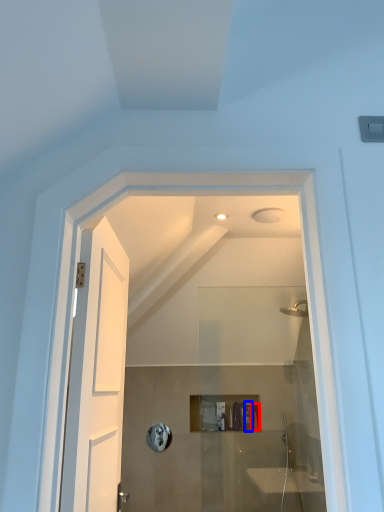
Question: Which object is closer to the camera taking this photo, toiletry (highlighted by a red box) or toiletry (highlighted by a blue box)?

Choices:
 (A) toiletry
 (B) toiletry

Answer: (B)